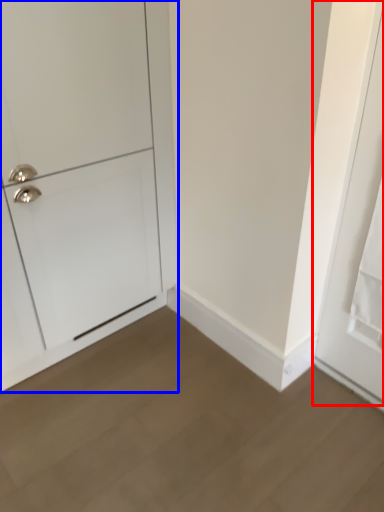
Question: Among these objects, which one is nearest to the camera, door (highlighted by a red box) or door (highlighted by a blue box)?

Choices:
 (A) door
 (B) door

Answer: (A)